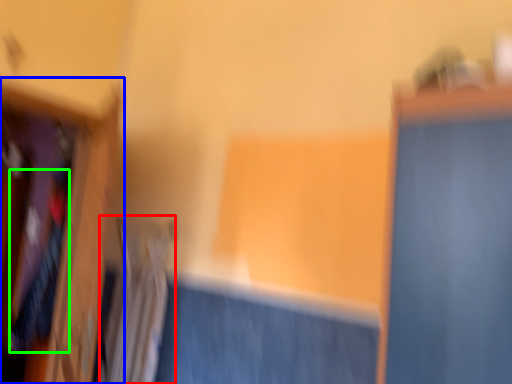
Question: Which is farther away from radiator (highlighted by a red box)? furniture (highlighted by a blue box) or clothing (highlighted by a green box)?

Choices:
 (A) furniture
 (B) clothing

Answer: (B)